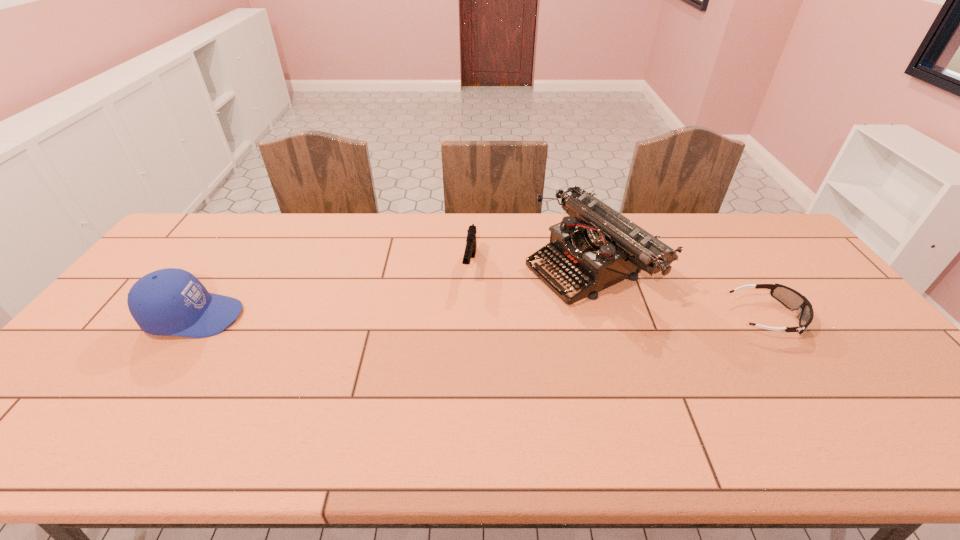
Find the location of a particular element. The image size is (960, 540). empty space between the goggles and the typewriter is located at coordinates (679, 291).

Find the location of `object that is the closest to the second tallest object`. object that is the closest to the second tallest object is located at coordinates (470, 250).

In order to click on object that stands as the closest to the goggles in this screenshot , I will do `click(598, 247)`.

Identify the location of free space that satisfies the following two spatial constraints: 1. on the front side of the shortest object; 2. on the front and sides of the tallest object. Image resolution: width=960 pixels, height=540 pixels. (605, 316).

At what (x,y) coordinates should I click in order to perform the action: click on vacant point that satisfies the following two spatial constraints: 1. on the front side of the pistol; 2. on the left side of the typewriter. Please return your answer as a coordinate pair (x, y). The width and height of the screenshot is (960, 540). Looking at the image, I should click on (470, 265).

Find the location of a particular element. The height and width of the screenshot is (540, 960). free point that satisfies the following two spatial constraints: 1. on the front side of the third tallest object; 2. on the front and sides of the shortest object is located at coordinates (468, 316).

You are a GUI agent. You are given a task and a screenshot of the screen. Output one action in this format:
    pyautogui.click(x=<x>, y=<y>)
    Task: Click on the vacant area in the image that satisfies the following two spatial constraints: 1. on the front side of the rightmost object; 2. on the front and sides of the second object from right to left
    
    Given the screenshot: What is the action you would take?
    pyautogui.click(x=605, y=316)